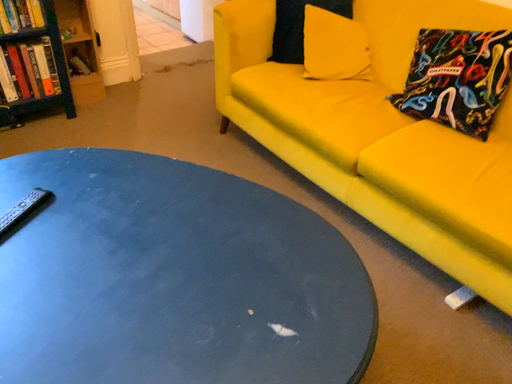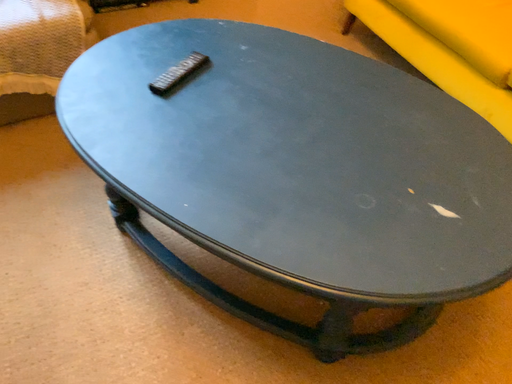
Question: How did the camera likely rotate when shooting the video?

Choices:
 (A) rotated left
 (B) rotated right

Answer: (A)